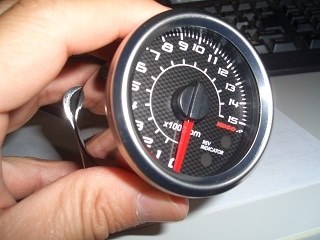
Identify the location of desktop. The width and height of the screenshot is (320, 240). (294, 211).